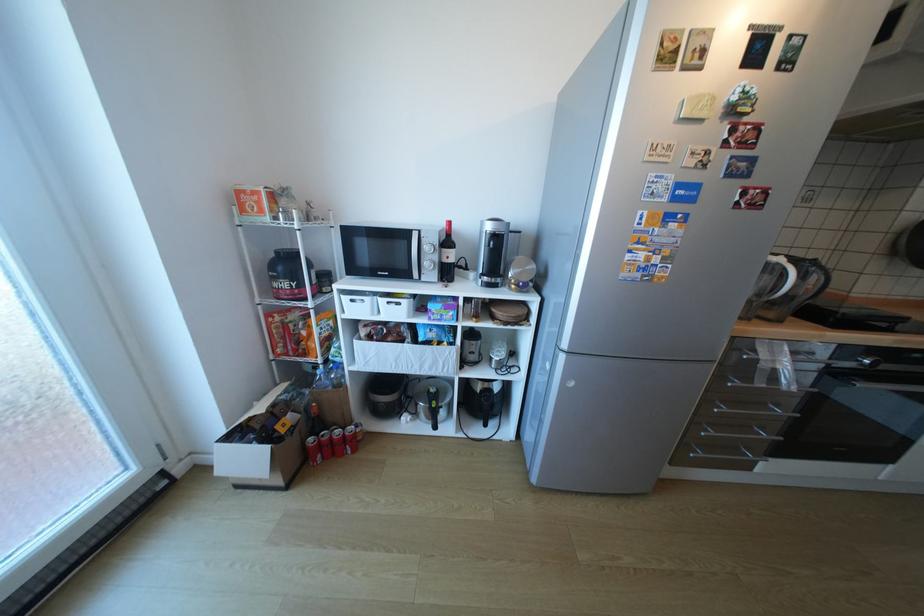
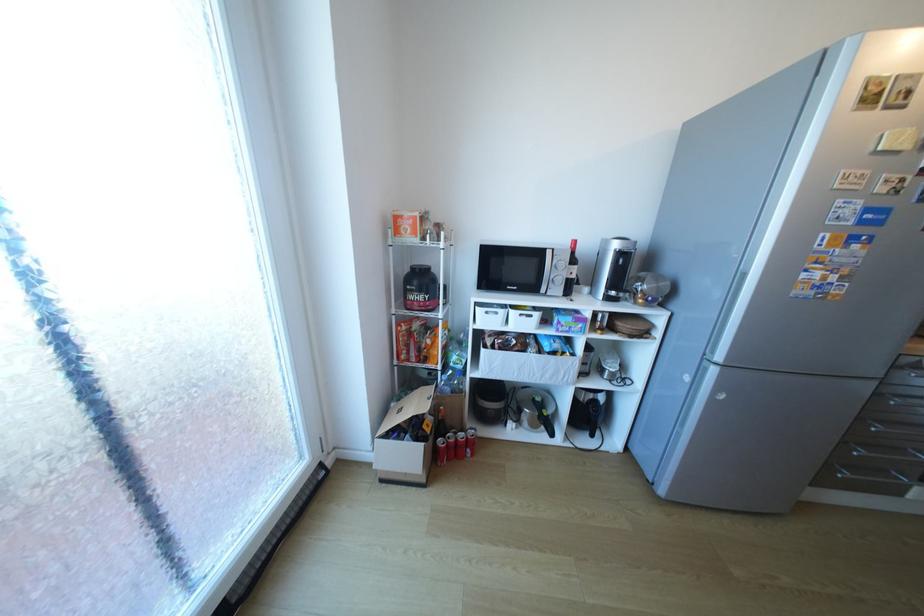
Where in the second image is the point corresponding to (250,440) from the first image?

(407, 437)